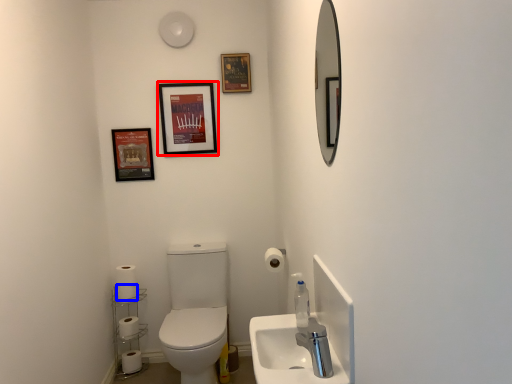
Question: Which object is closer to the camera taking this photo, picture frame (highlighted by a red box) or toilet paper (highlighted by a blue box)?

Choices:
 (A) picture frame
 (B) toilet paper

Answer: (B)